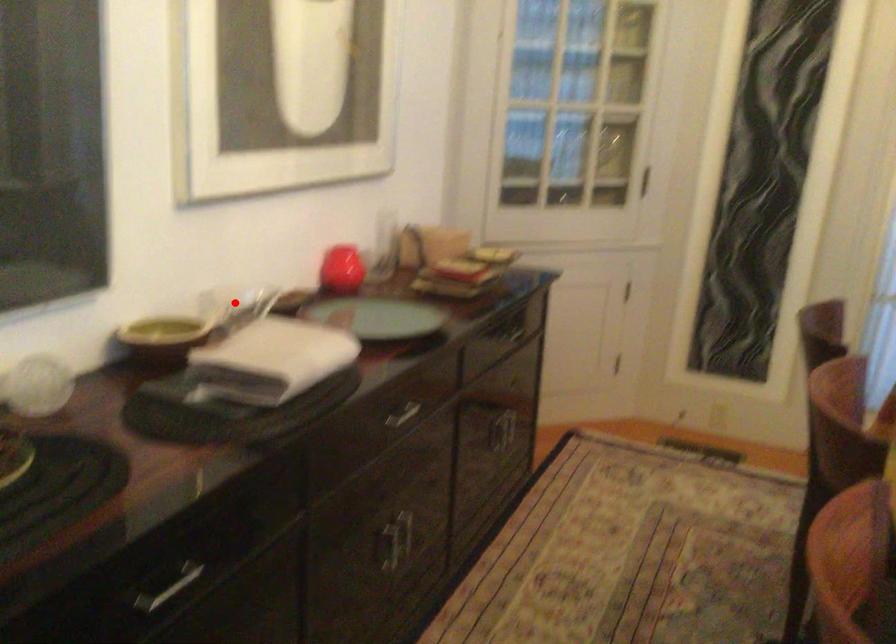
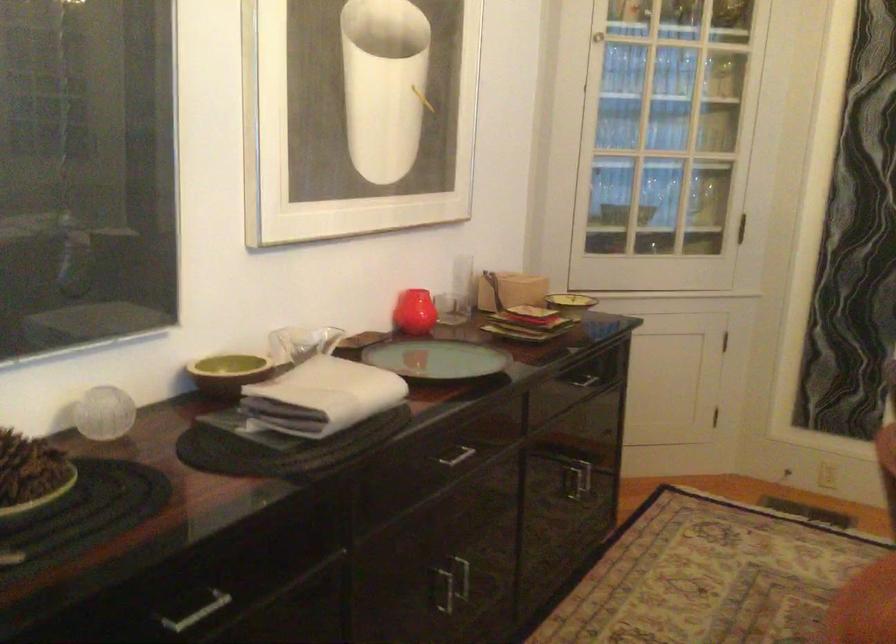
In the second image, find the point that corresponds to the highlighted location in the first image.

(300, 343)